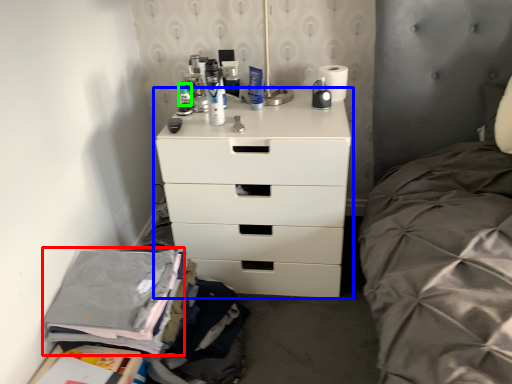
Question: Considering the real-world distances, which object is closest to clothing (highlighted by a red box)? chest of drawers (highlighted by a blue box) or toiletry (highlighted by a green box).

Choices:
 (A) chest of drawers
 (B) toiletry

Answer: (A)